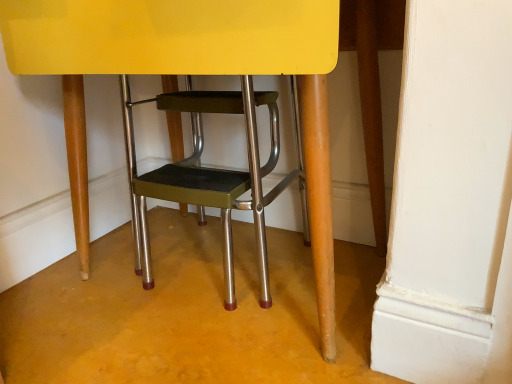
Question: Considering the relative positions of metallic green step stool at center and metallic green stool at center in the image provided, is metallic green step stool at center in front of metallic green stool at center?

Choices:
 (A) no
 (B) yes

Answer: (B)

Question: Is metallic green stool at center surrounded by metallic green step stool at center?

Choices:
 (A) no
 (B) yes

Answer: (B)

Question: Is metallic green step stool at center aimed at metallic green stool at center?

Choices:
 (A) no
 (B) yes

Answer: (B)

Question: From the image's perspective, is metallic green step stool at center below metallic green stool at center?

Choices:
 (A) yes
 (B) no

Answer: (B)

Question: Considering the relative sizes of metallic green step stool at center and metallic green stool at center in the image provided, is metallic green step stool at center thinner than metallic green stool at center?

Choices:
 (A) yes
 (B) no

Answer: (B)

Question: From the image's perspective, is metallic green step stool at center on metallic green stool at center?

Choices:
 (A) no
 (B) yes

Answer: (B)

Question: Is metallic green stool at center bigger than metallic green step stool at center?

Choices:
 (A) yes
 (B) no

Answer: (B)

Question: Does metallic green stool at center come in front of metallic green step stool at center?

Choices:
 (A) no
 (B) yes

Answer: (A)

Question: From a real-world perspective, is metallic green stool at center on metallic green step stool at center?

Choices:
 (A) yes
 (B) no

Answer: (B)

Question: From the image's perspective, is metallic green stool at center over metallic green step stool at center?

Choices:
 (A) no
 (B) yes

Answer: (A)

Question: Does metallic green stool at center have a lesser width compared to metallic green step stool at center?

Choices:
 (A) no
 (B) yes

Answer: (B)

Question: Are metallic green stool at center and metallic green step stool at center beside each other?

Choices:
 (A) no
 (B) yes

Answer: (A)

Question: Is metallic green step stool at center in front of or behind metallic green stool at center in the image?

Choices:
 (A) front
 (B) behind

Answer: (A)